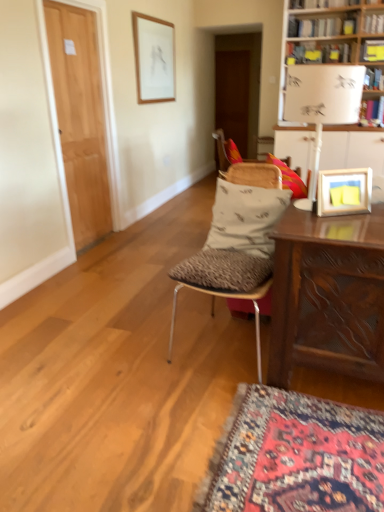
Locate an element on the screen. The image size is (384, 512). vacant area that lies to the right of light brown wood door at left, the 1th door viewed from the front is located at coordinates (135, 238).